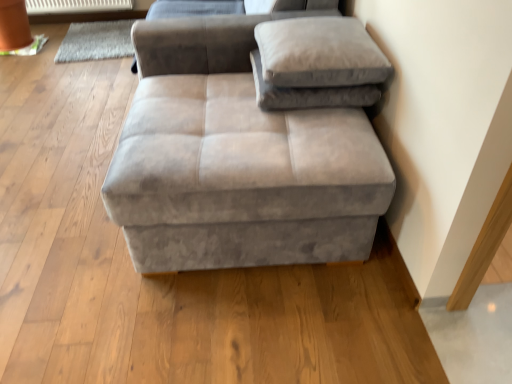
Where is `vacant area that is in front of suede gray pillow at upper right, placed as the first pillow when sorted from bottom to top`? vacant area that is in front of suede gray pillow at upper right, placed as the first pillow when sorted from bottom to top is located at coordinates (306, 128).